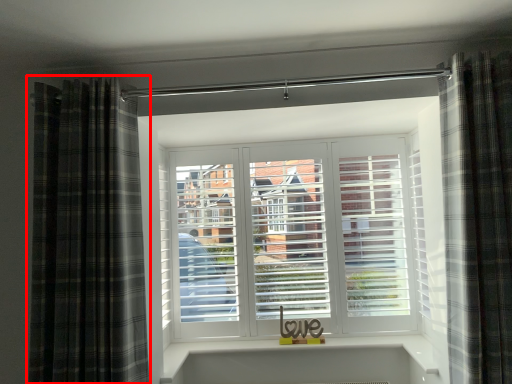
Question: In this image, where is curtain (annotated by the red box) located relative to curtain?

Choices:
 (A) right
 (B) left

Answer: (B)